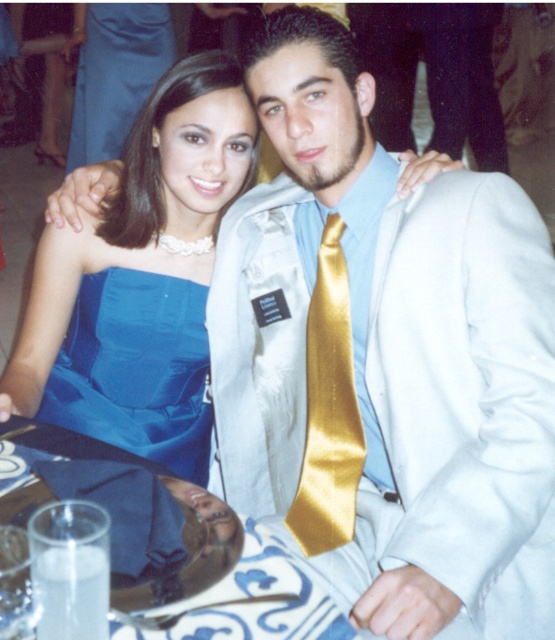
Can you confirm if satin white suit at center is positioned below gold satin tie at center?

Actually, satin white suit at center is above gold satin tie at center.

Locate an element on the screen. The image size is (555, 640). satin white suit at center is located at coordinates (388, 355).

Measure the distance from porcelain plate at center to gold satin tie at center.

They are 19.59 inches apart.

Is porcelain plate at center positioned behind gold satin tie at center?

No, it is in front of gold satin tie at center.

Is point (73, 442) closer to camera compared to point (325, 312)?

Yes, it is in front of point (325, 312).

Find the location of a particular element. Image resolution: width=555 pixels, height=640 pixels. porcelain plate at center is located at coordinates (229, 586).

Between satin white suit at center and porcelain plate at center, which one appears on the left side from the viewer's perspective?

Positioned to the left is porcelain plate at center.

You are a GUI agent. You are given a task and a screenshot of the screen. Output one action in this format:
    pyautogui.click(x=<x>, y=<y>)
    Task: Click on the satin white suit at center
    
    Given the screenshot: What is the action you would take?
    pyautogui.click(x=388, y=355)

At what (x,y) coordinates should I click in order to perform the action: click on satin white suit at center. Please return your answer as a coordinate pair (x, y). This screenshot has height=640, width=555. Looking at the image, I should click on (388, 355).